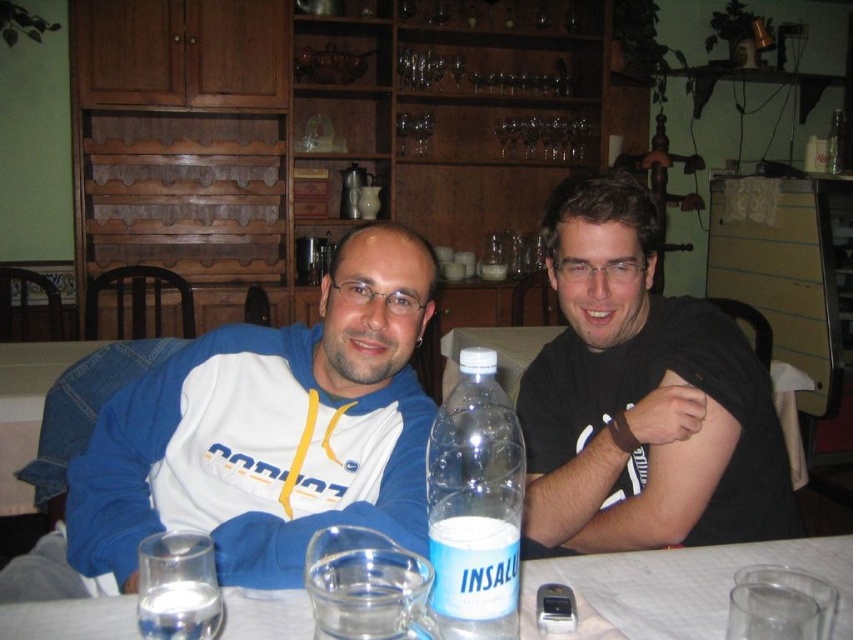
From the picture: How distant is clear glass water at lower center from clear glass water at lower left?

clear glass water at lower center and clear glass water at lower left are 16.95 inches apart.

Which is behind, point (280, 632) or point (141, 552)?

Point (280, 632)

Identify the location of clear glass water at lower center. (676, 588).

Looking at this image, does black matte shirt at right have a lesser width compared to clear glass water at lower left?

No, black matte shirt at right is not thinner than clear glass water at lower left.

Which of these two, black matte shirt at right or clear glass water at lower left, stands shorter?

clear glass water at lower left is shorter.

Is point (631, 339) farther from viewer compared to point (155, 563)?

Yes, it is.

You are a GUI agent. You are given a task and a screenshot of the screen. Output one action in this format:
    pyautogui.click(x=<x>, y=<y>)
    Task: Click on the black matte shirt at right
    The width and height of the screenshot is (853, 640).
    Given the screenshot: What is the action you would take?
    pyautogui.click(x=642, y=397)

Does clear plastic bottle at center have a larger size compared to clear glass water at lower left?

Indeed, clear plastic bottle at center has a larger size compared to clear glass water at lower left.

Between point (517, 572) and point (180, 584), which one is positioned in front?

Point (517, 572) is in front.

Locate an element on the screen. The image size is (853, 640). clear plastic bottle at center is located at coordinates (474, 506).